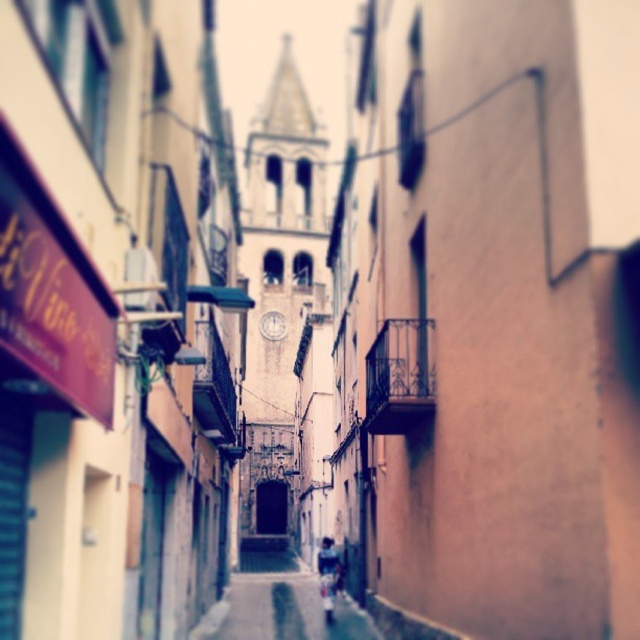
Question: Can you confirm if smooth concrete alley at center is smaller than dark blue denim jacket at center?

Choices:
 (A) yes
 (B) no

Answer: (B)

Question: Which object is closer to the camera taking this photo?

Choices:
 (A) smooth concrete alley at center
 (B) dark blue denim jacket at center

Answer: (A)

Question: Which of the following is the closest to the observer?

Choices:
 (A) smooth concrete alley at center
 (B) dark blue denim jacket at center

Answer: (A)

Question: Is smooth concrete alley at center below dark blue denim jacket at center?

Choices:
 (A) no
 (B) yes

Answer: (B)

Question: Does smooth concrete alley at center have a smaller size compared to dark blue denim jacket at center?

Choices:
 (A) yes
 (B) no

Answer: (B)